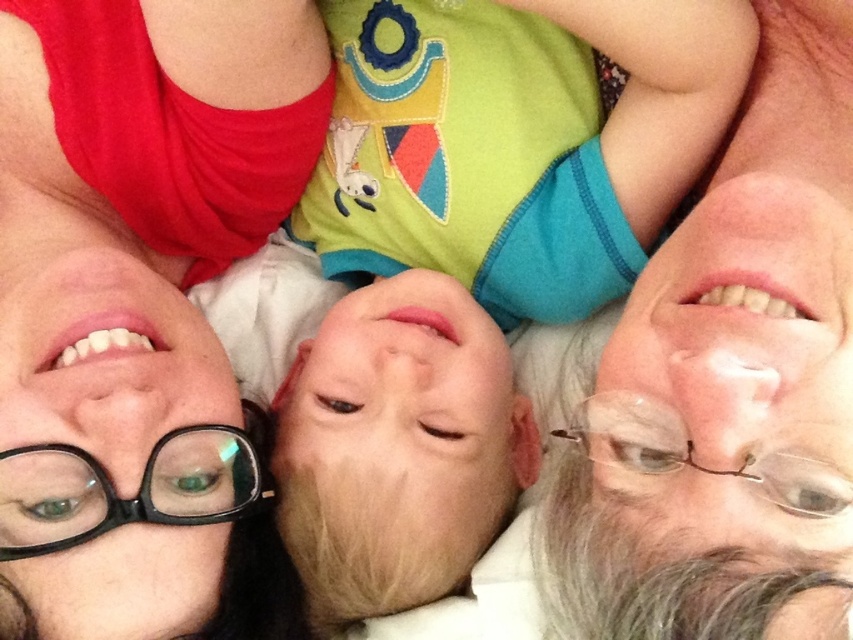
You are trying to place a small sticker between the matte black glasses at upper left and the gray hair at right. Based on their widths, can you determine if there will be enough space for the sticker?

The matte black glasses at upper left might be wider than gray hair at right, so there may not be enough space for the sticker between them.